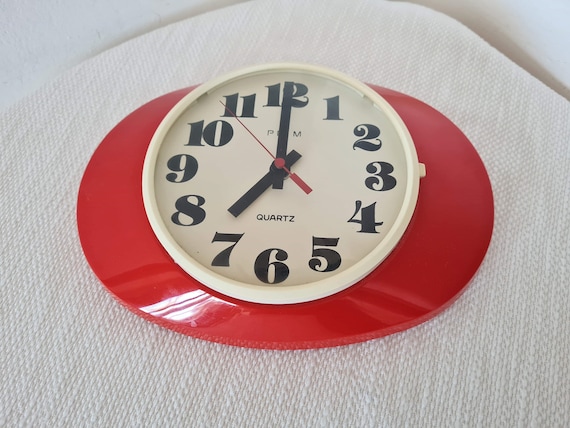
Find the location of a particular element. The image size is (570, 428). "2" on clock face is located at coordinates (370, 133).